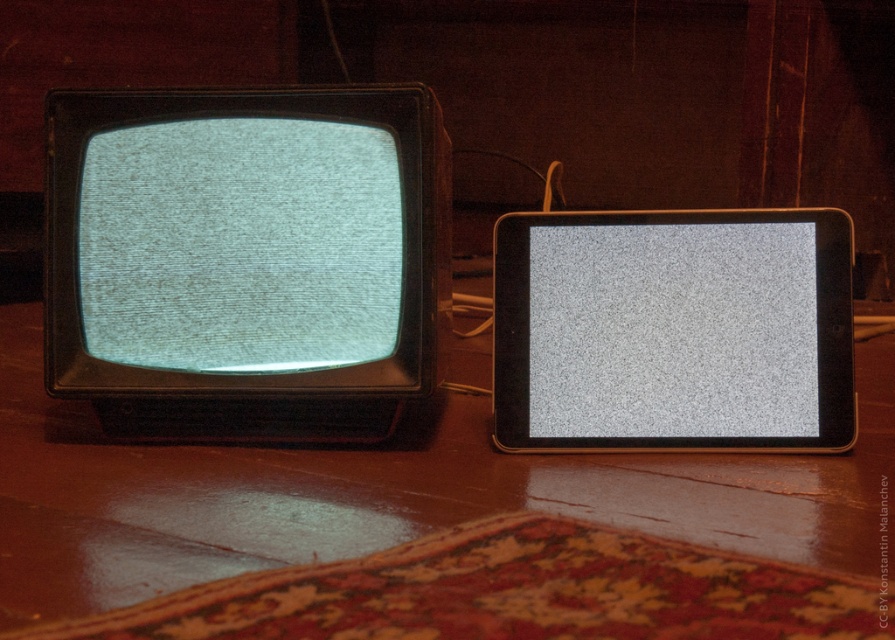
You are organizing a tech exhibition and need to place the teal matte screen at left and the gray matte screen at center in a row. According to the image, which screen should you place first from the viewer perspective?

The teal matte screen at left should be placed first from the viewer perspective since it is positioned on the left side of the gray matte screen at center in the image.

You are standing in front of the two electronic devices on the wooden surface. Which of the points, point (x=45, y=620) or point (x=533, y=244), is closer to you?

Point (x=45, y=620) is closer to you because it is in front of point (x=533, y=244).

You are standing in front of the wooden table at center and the gray matte screen at center. Which object is nearer to you?

The wooden table at center is closer to the viewer than the gray matte screen at center.